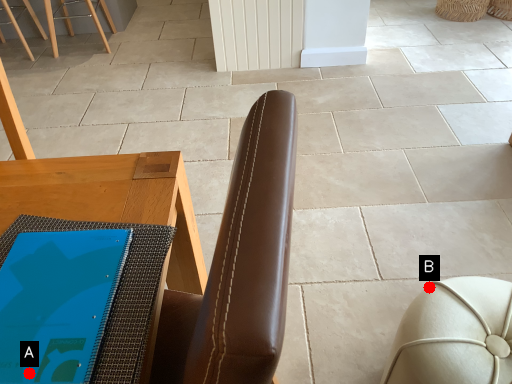
Question: Two points are circled on the image, labeled by A and B beside each circle. Which point appears closest to the camera in this image?

Choices:
 (A) A is closer
 (B) B is closer

Answer: (A)